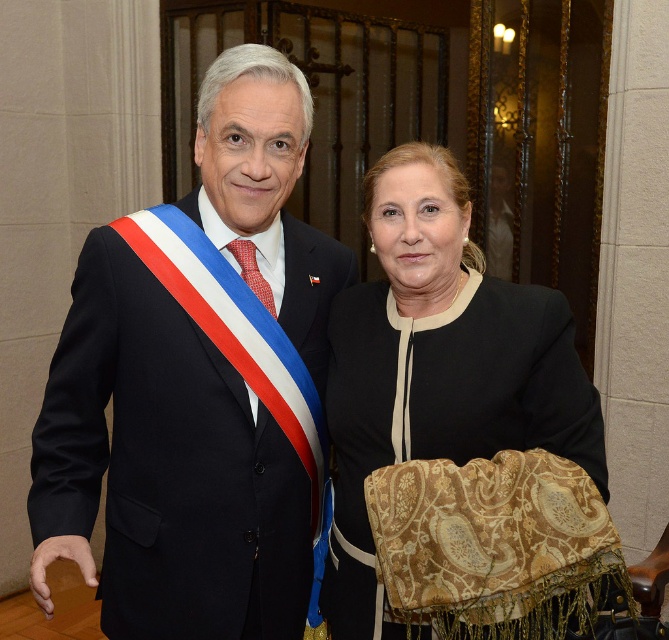
Can you confirm if matte black suit at left is positioned below matte black jacket at center?

Incorrect, matte black suit at left is not positioned below matte black jacket at center.

How distant is matte black suit at left from matte black jacket at center?

The distance of matte black suit at left from matte black jacket at center is 11.59 inches.

Who is more forward, (199, 339) or (326, 589)?

Positioned in front is point (199, 339).

Locate an element on the screen. This screenshot has height=640, width=669. matte black suit at left is located at coordinates (197, 385).